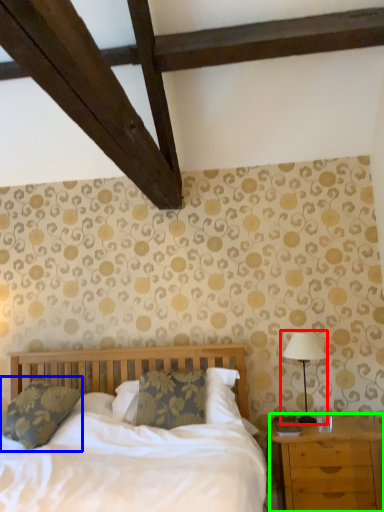
Question: Estimate the real-world distances between objects in this image. Which object is closer to table lamp (highlighted by a red box), pillow (highlighted by a blue box) or nightstand (highlighted by a green box)?

Choices:
 (A) pillow
 (B) nightstand

Answer: (B)